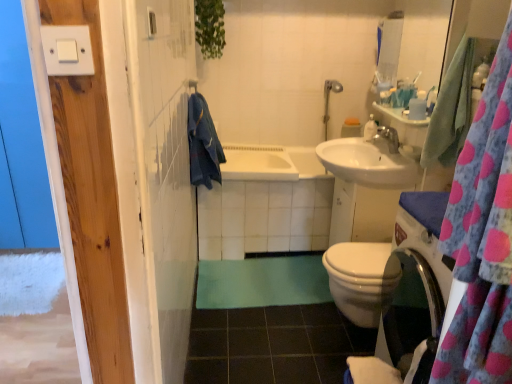
The image size is (512, 384). Identify the location of free space in front of silver metallic faucet at upper center. (392, 163).